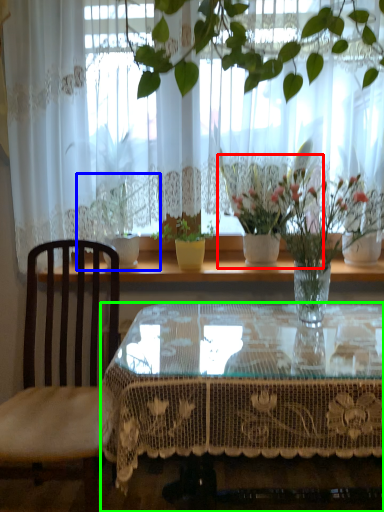
Question: Based on their relative distances, which object is nearer to houseplant (highlighted by a red box)? Choose from houseplant (highlighted by a blue box) and coffee table (highlighted by a green box).

Choices:
 (A) houseplant
 (B) coffee table

Answer: (B)